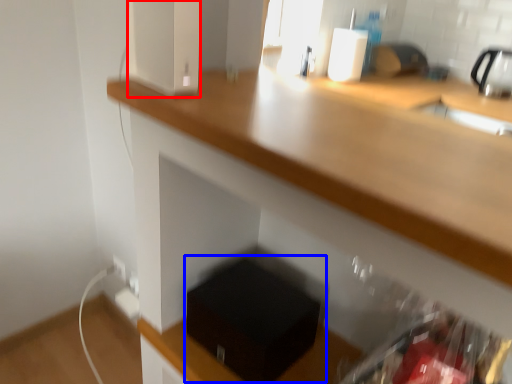
Question: Which object is closer to the camera taking this photo, appliance (highlighted by a red box) or box (highlighted by a blue box)?

Choices:
 (A) appliance
 (B) box

Answer: (A)